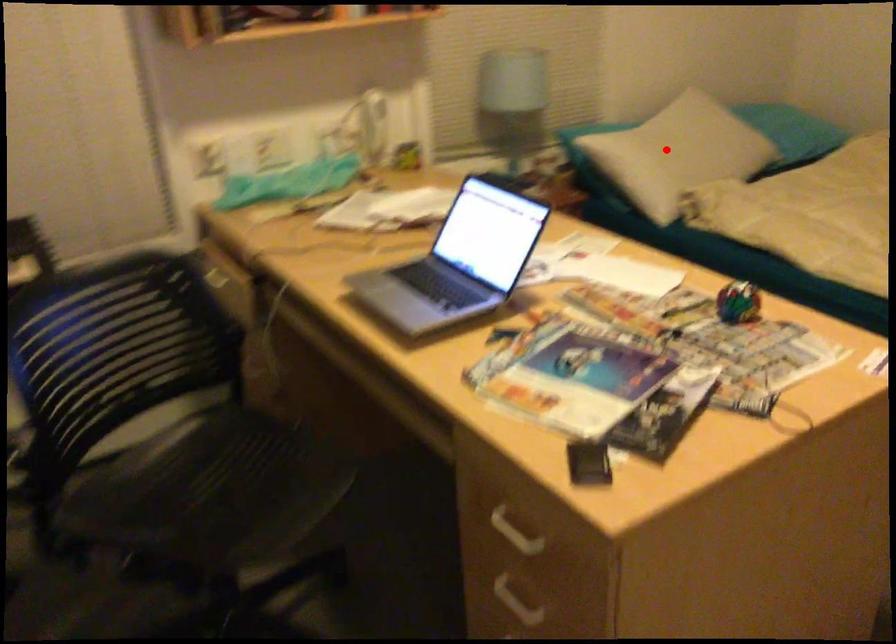
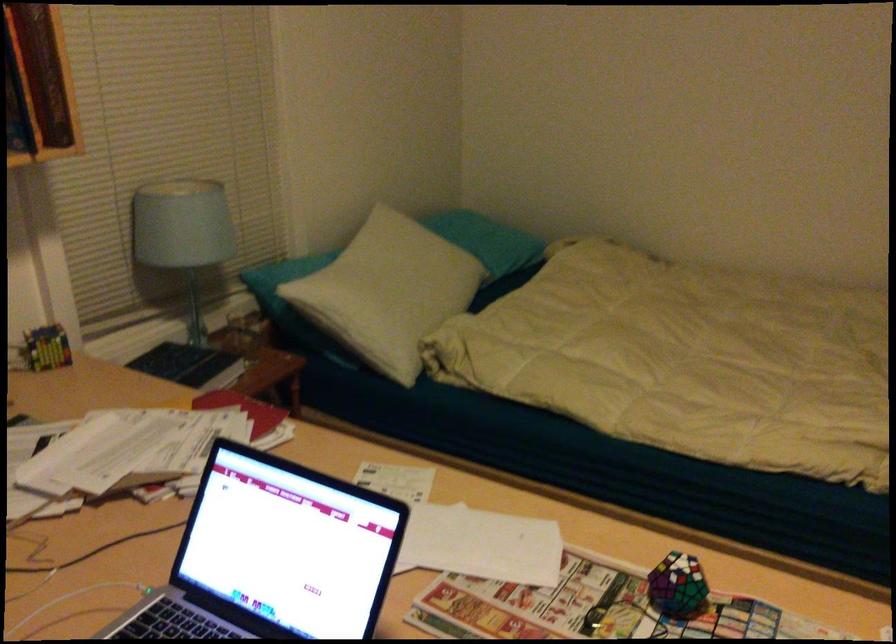
Where in the second image is the point corresponding to the highlighted location from the first image?

(391, 285)